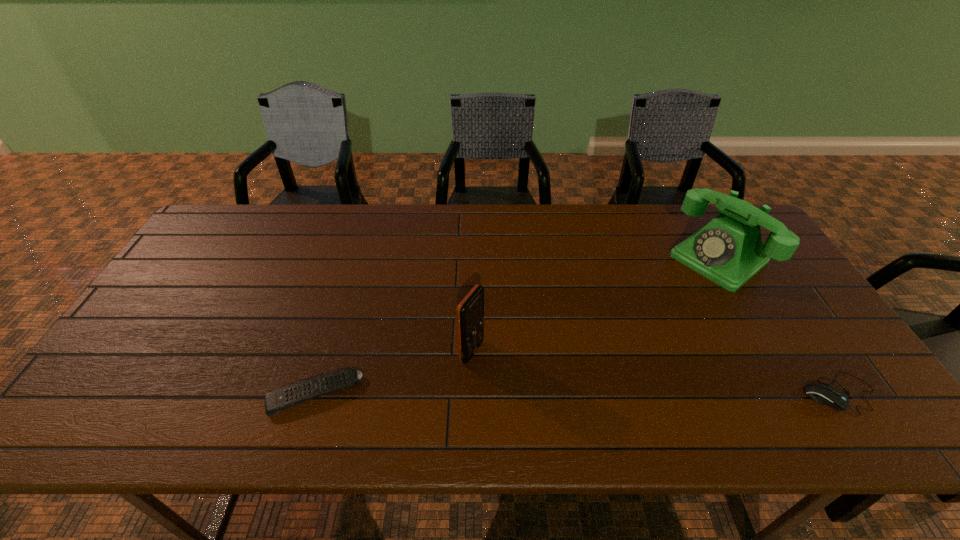
Identify the location of free space between the second shortest object and the leftmost object. The image size is (960, 540). (577, 393).

At what (x,y) coordinates should I click in order to perform the action: click on unoccupied area between the telephone and the second object from left to right. Please return your answer as a coordinate pair (x, y). This screenshot has width=960, height=540. Looking at the image, I should click on (595, 305).

Identify the location of unoccupied position between the third tallest object and the third object from right to left. (656, 373).

Where is `empty space between the shortest object and the farthest object`? Image resolution: width=960 pixels, height=540 pixels. empty space between the shortest object and the farthest object is located at coordinates (516, 326).

This screenshot has height=540, width=960. Find the location of `empty space that is in between the remote control and the cellular telephone`. empty space that is in between the remote control and the cellular telephone is located at coordinates (393, 373).

Where is `free space between the computer mouse and the third nearest object`? free space between the computer mouse and the third nearest object is located at coordinates (656, 373).

In order to click on object that stands as the third closest to the farthest object in this screenshot , I will do `click(278, 400)`.

The image size is (960, 540). I want to click on object that stands as the closest to the third nearest object, so click(278, 400).